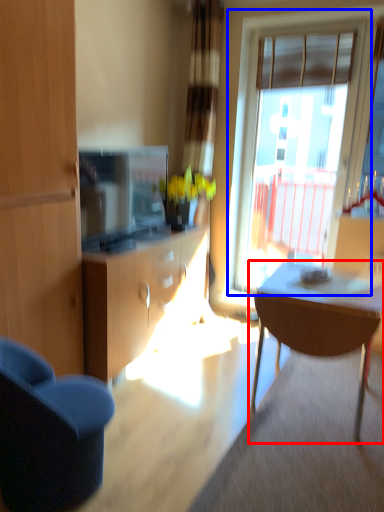
Question: Among these objects, which one is nearest to the camera, kitchen & dining room table (highlighted by a red box) or window (highlighted by a blue box)?

Choices:
 (A) kitchen & dining room table
 (B) window

Answer: (A)